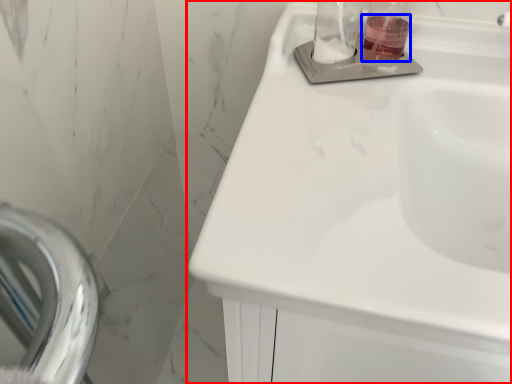
Question: Which object appears closest to the camera in this image, sink (highlighted by a red box) or liquid (highlighted by a blue box)?

Choices:
 (A) sink
 (B) liquid

Answer: (A)